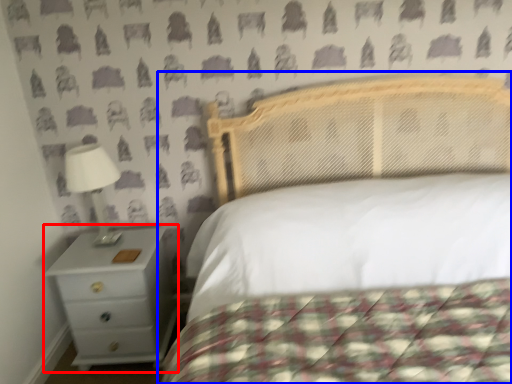
Question: Among these objects, which one is nearest to the camera, nightstand (highlighted by a red box) or bed (highlighted by a blue box)?

Choices:
 (A) nightstand
 (B) bed

Answer: (B)